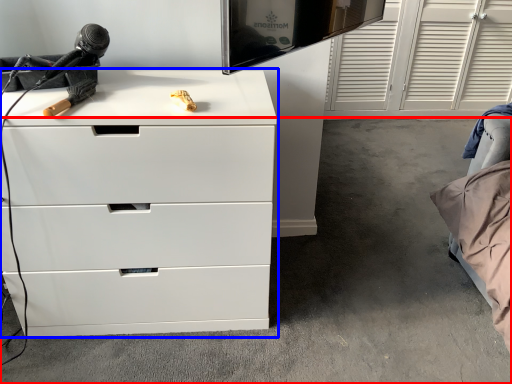
Question: Which object is closer to the camera taking this photo, concrete (highlighted by a red box) or chest of drawers (highlighted by a blue box)?

Choices:
 (A) concrete
 (B) chest of drawers

Answer: (B)